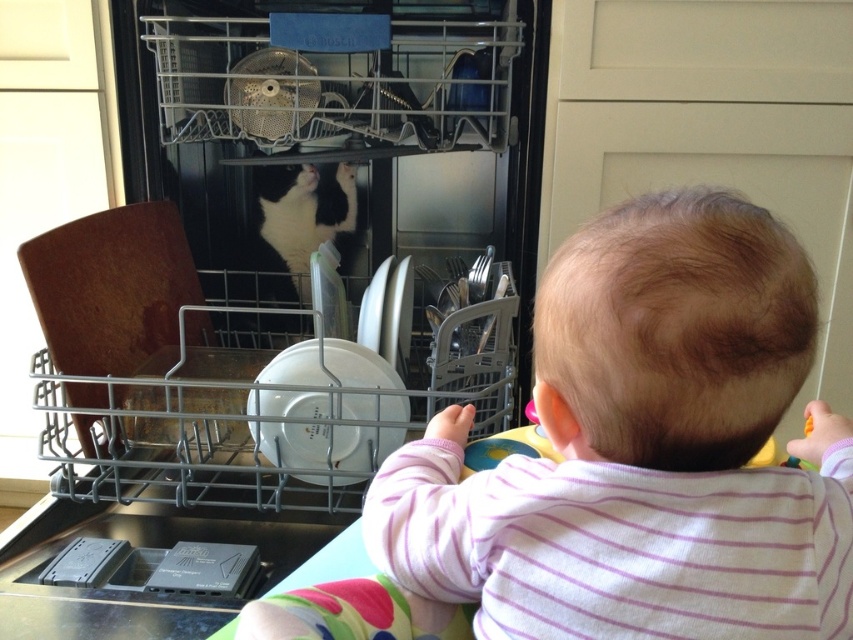
Can you confirm if matte black dishwasher at center is thinner than black and white fur at center?

No, matte black dishwasher at center is not thinner than black and white fur at center.

Who is lower down, matte black dishwasher at center or black and white fur at center?

matte black dishwasher at center is below.

This screenshot has width=853, height=640. What are the coordinates of `matte black dishwasher at center` in the screenshot? It's located at (265, 305).

Where is `matte black dishwasher at center`? The height and width of the screenshot is (640, 853). matte black dishwasher at center is located at coordinates click(x=265, y=305).

Who is positioned more to the right, matte black dishwasher at center or smooth pink shirt at center?

smooth pink shirt at center is more to the right.

Based on the photo, does matte black dishwasher at center have a lesser width compared to smooth pink shirt at center?

No.

Measure the distance between matte black dishwasher at center and camera.

matte black dishwasher at center and camera are 28.54 inches apart from each other.

Identify the location of matte black dishwasher at center. (265, 305).

Is point (778, 312) less distant than point (265, 214)?

Yes, it is in front of point (265, 214).

Between smooth pink shirt at center and black and white fur at center, which one appears on the left side from the viewer's perspective?

Positioned to the left is black and white fur at center.

You are a GUI agent. You are given a task and a screenshot of the screen. Output one action in this format:
    pyautogui.click(x=<x>, y=<y>)
    Task: Click on the smooth pink shirt at center
    
    Given the screenshot: What is the action you would take?
    pyautogui.click(x=643, y=449)